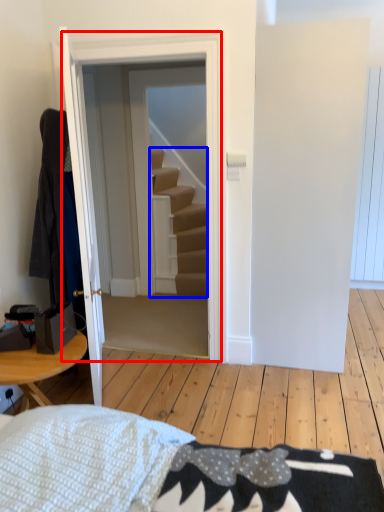
Question: Among these objects, which one is nearest to the camera, door (highlighted by a red box) or stairs (highlighted by a blue box)?

Choices:
 (A) door
 (B) stairs

Answer: (A)